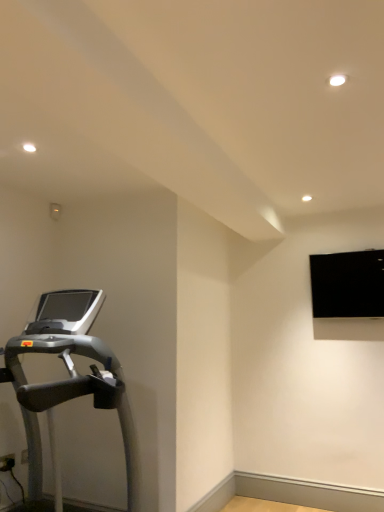
Locate an element on the screen. This screenshot has width=384, height=512. vacant point above black matte projection screen at upper right (from a real-world perspective) is located at coordinates (352, 247).